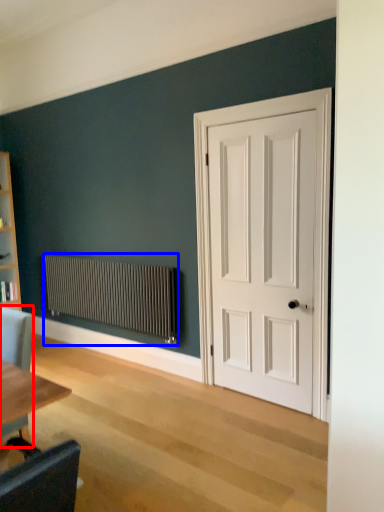
Question: Which of the following is the farthest to the observer, chair (highlighted by a red box) or radiator (highlighted by a blue box)?

Choices:
 (A) chair
 (B) radiator

Answer: (B)